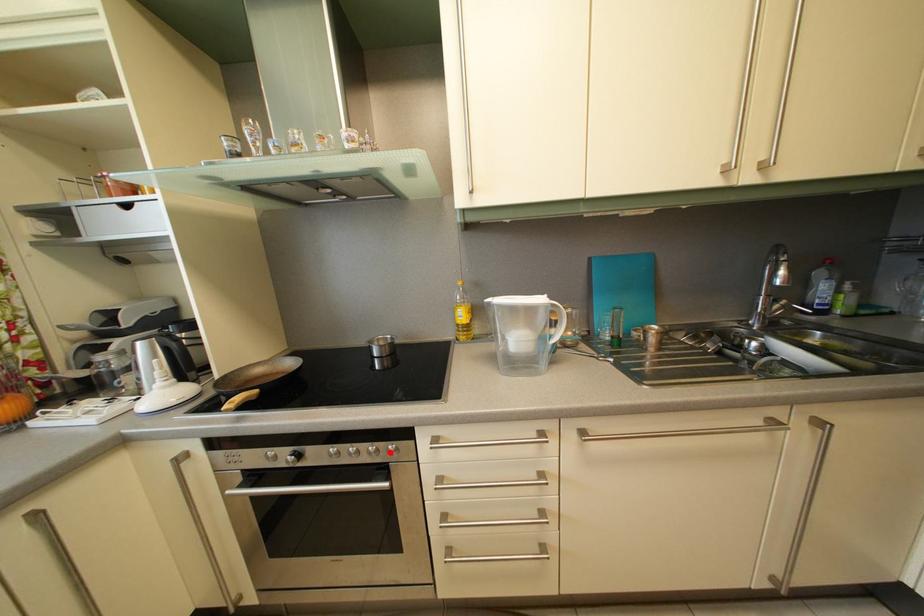
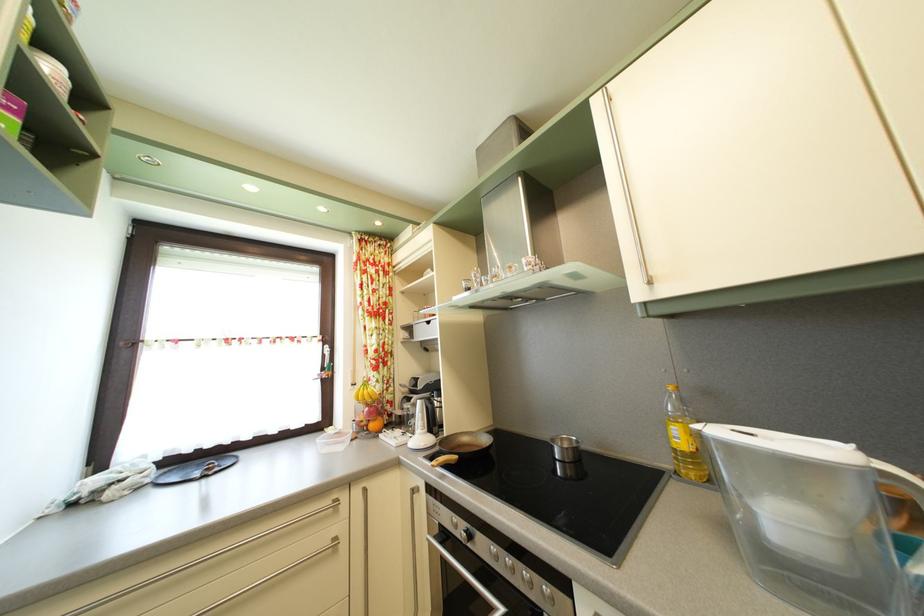
Find the pixel in the second image that matches the highlighted location in the first image.

(543, 585)